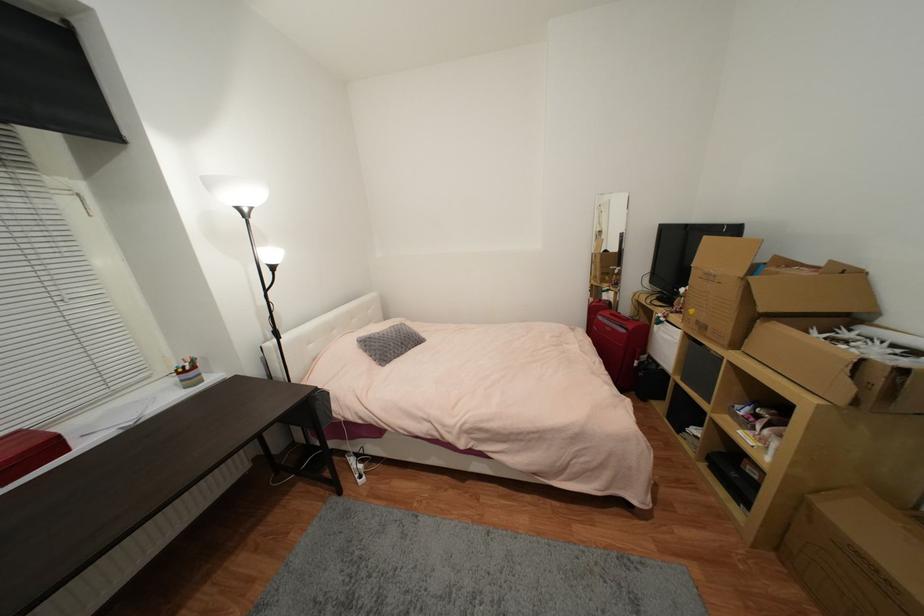
I want to click on suitcase handle, so click(x=622, y=320).